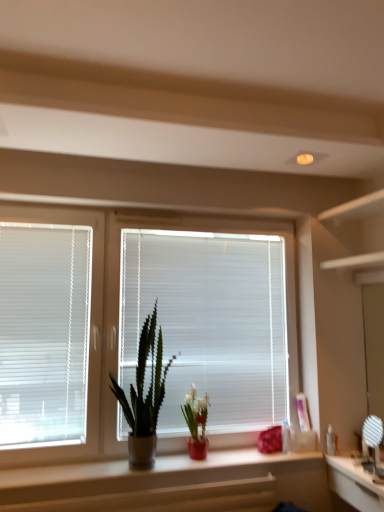
Question: Is white plastic blinds at left, the second window blind when ordered from right to left, positioned far away from white glossy mirror at lower right?

Choices:
 (A) yes
 (B) no

Answer: (A)

Question: Is white plastic blinds at left, which is counted as the 1th window blind, starting from the left, completely or partially outside of white glossy mirror at lower right?

Choices:
 (A) no
 (B) yes

Answer: (B)

Question: Is white glossy mirror at lower right at the back of white plastic blinds at left, which is counted as the 1th window blind, starting from the left?

Choices:
 (A) no
 (B) yes

Answer: (A)

Question: From the image's perspective, is white plastic blinds at left, the second window blind when ordered from right to left, over white glossy mirror at lower right?

Choices:
 (A) no
 (B) yes

Answer: (B)

Question: Can you confirm if white plastic blinds at left, which is counted as the 1th window blind, starting from the left, is wider than white glossy mirror at lower right?

Choices:
 (A) no
 (B) yes

Answer: (A)

Question: Looking at their shapes, would you say white glossy mirror at lower right is wider or thinner than matte plastic bottle at center, which ranks as the 1th toiletry in left-to-right order?

Choices:
 (A) thin
 (B) wide

Answer: (B)

Question: Considering the positions of white glossy mirror at lower right and matte plastic bottle at center, arranged as the second toiletry when viewed from the right, in the image, is white glossy mirror at lower right taller or shorter than matte plastic bottle at center, arranged as the second toiletry when viewed from the right,?

Choices:
 (A) tall
 (B) short

Answer: (A)

Question: From the image's perspective, relative to matte plastic bottle at center, which ranks as the 1th toiletry in left-to-right order, is white glossy mirror at lower right above or below?

Choices:
 (A) above
 (B) below

Answer: (B)

Question: In the image, is white glossy mirror at lower right positioned in front of or behind matte plastic bottle at center, which ranks as the 1th toiletry in left-to-right order?

Choices:
 (A) front
 (B) behind

Answer: (A)

Question: In terms of height, does white plastic blinds at center, arranged as the 1th window blind when viewed from the right, look taller or shorter compared to matte red vase at center, which is counted as the second houseplant, starting from the left?

Choices:
 (A) short
 (B) tall

Answer: (B)

Question: From the image's perspective, relative to matte red vase at center, which is counted as the first houseplant, starting from the right, is white plastic blinds at center, marked as the second window blind in a left-to-right arrangement, above or below?

Choices:
 (A) below
 (B) above

Answer: (B)

Question: Is point (130, 330) closer or farther from the camera than point (195, 457)?

Choices:
 (A) closer
 (B) farther

Answer: (B)

Question: Relative to matte red vase at center, which is counted as the second houseplant, starting from the left, is white plastic blinds at center, arranged as the 1th window blind when viewed from the right, in front or behind?

Choices:
 (A) front
 (B) behind

Answer: (B)

Question: In terms of height, does white plastic blinds at left, the second window blind when ordered from right to left, look taller or shorter compared to clear plastic bottle at right, the first toiletry positioned from the right?

Choices:
 (A) short
 (B) tall

Answer: (B)

Question: From the image's perspective, is white plastic blinds at left, the second window blind when ordered from right to left, above or below clear plastic bottle at right, arranged as the second toiletry when viewed from the left?

Choices:
 (A) below
 (B) above

Answer: (B)